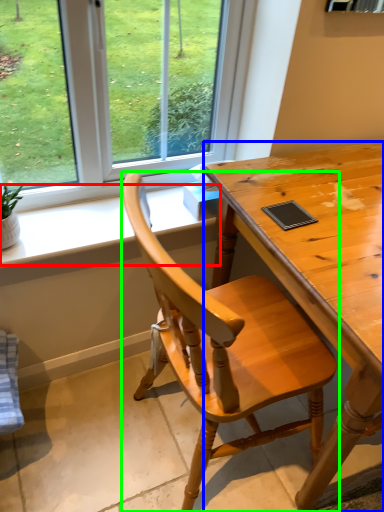
Question: Considering the real-world distances, which object is farthest from window sill (highlighted by a red box)? desk (highlighted by a blue box) or chair (highlighted by a green box)?

Choices:
 (A) desk
 (B) chair

Answer: (B)